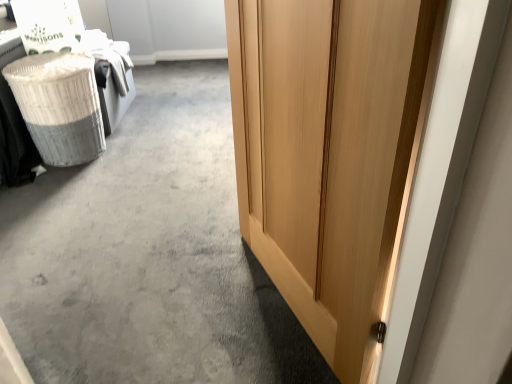
Question: From a real-world perspective, is white wicker laundry basket at left under wooden door at right?

Choices:
 (A) no
 (B) yes

Answer: (A)

Question: Would you say white wicker laundry basket at left is a long distance from wooden door at right?

Choices:
 (A) no
 (B) yes

Answer: (A)

Question: Considering the relative sizes of white wicker laundry basket at left and wooden door at right in the image provided, is white wicker laundry basket at left wider than wooden door at right?

Choices:
 (A) no
 (B) yes

Answer: (A)

Question: Considering the relative positions of white wicker laundry basket at left and wooden door at right in the image provided, is white wicker laundry basket at left to the left of wooden door at right from the viewer's perspective?

Choices:
 (A) no
 (B) yes

Answer: (B)

Question: Would you say white wicker laundry basket at left is outside wooden door at right?

Choices:
 (A) no
 (B) yes

Answer: (B)

Question: Considering the relative sizes of white wicker laundry basket at left and wooden door at right in the image provided, is white wicker laundry basket at left bigger than wooden door at right?

Choices:
 (A) no
 (B) yes

Answer: (A)

Question: Considering the relative positions of light wood door at right and white wicker laundry basket at left in the image provided, is light wood door at right to the right of white wicker laundry basket at left from the viewer's perspective?

Choices:
 (A) yes
 (B) no

Answer: (A)

Question: Can you confirm if light wood door at right is taller than white wicker laundry basket at left?

Choices:
 (A) yes
 (B) no

Answer: (A)

Question: Does light wood door at right come behind white wicker laundry basket at left?

Choices:
 (A) no
 (B) yes

Answer: (A)

Question: Can you confirm if light wood door at right is thinner than white wicker laundry basket at left?

Choices:
 (A) no
 (B) yes

Answer: (B)

Question: From the image's perspective, would you say light wood door at right is shown under white wicker laundry basket at left?

Choices:
 (A) no
 (B) yes

Answer: (B)

Question: Is light wood door at right oriented towards white wicker laundry basket at left?

Choices:
 (A) no
 (B) yes

Answer: (A)

Question: Does white wicker laundry basket at left have a greater width compared to light wood door at right?

Choices:
 (A) yes
 (B) no

Answer: (A)